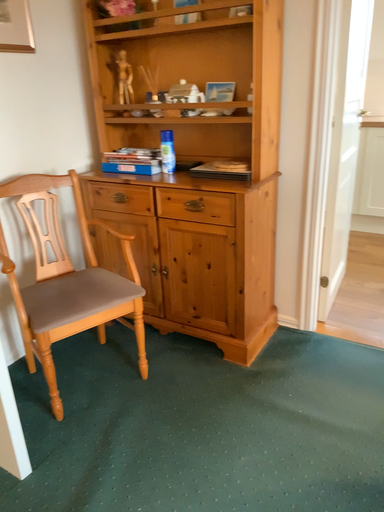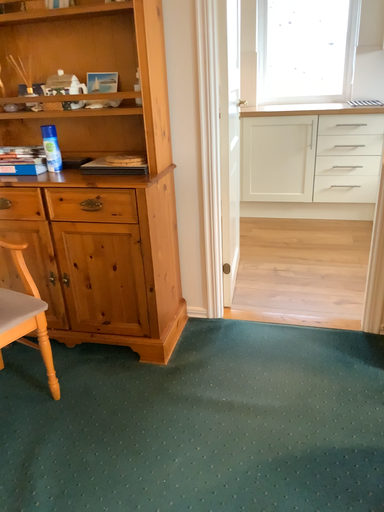
Question: How did the camera likely rotate when shooting the video?

Choices:
 (A) rotated left
 (B) rotated right

Answer: (B)